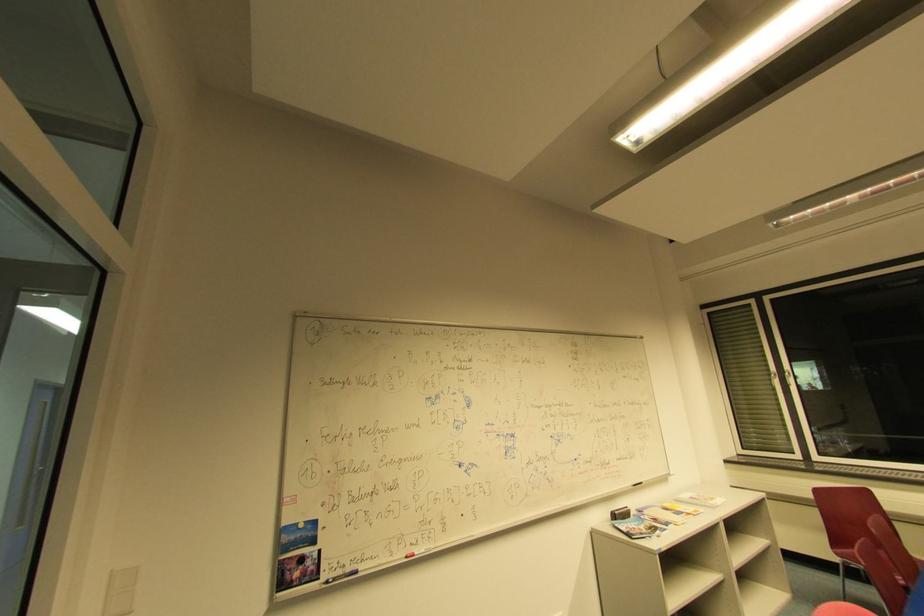
Describe the element at coordinates (786, 378) in the screenshot. I see `a white window handle` at that location.